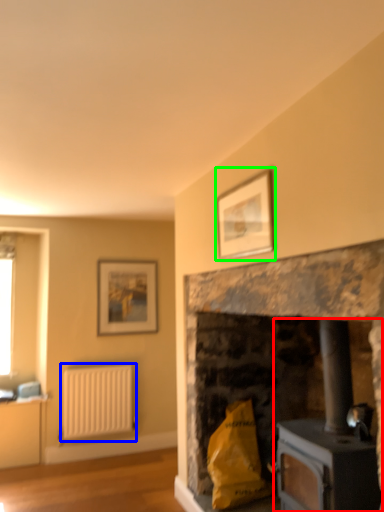
Question: Based on their relative distances, which object is farther from wood burning stove (highlighted by a red box)? Choose from radiator (highlighted by a blue box) and picture frame (highlighted by a green box).

Choices:
 (A) radiator
 (B) picture frame

Answer: (A)